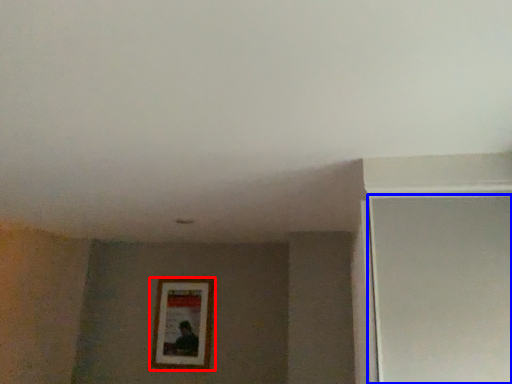
Question: Which point is further to the camera, picture frame (highlighted by a red box) or screen door (highlighted by a blue box)?

Choices:
 (A) picture frame
 (B) screen door

Answer: (A)